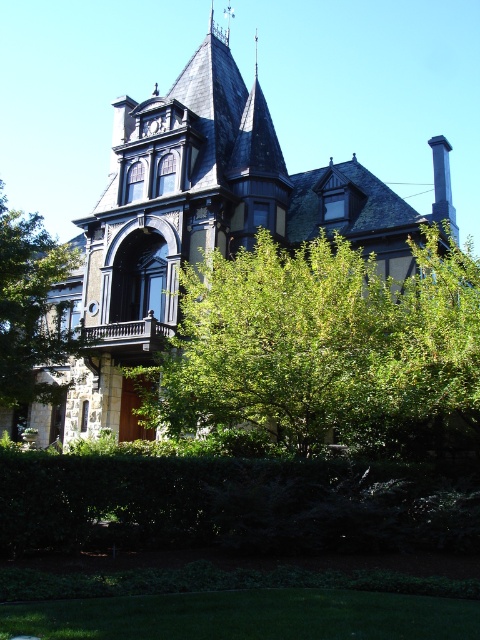
Consider the image. You are standing in front of the Victorian house and notice the dark gray stone mansion at center and the green leafy tree at center. Which object is positioned more to the left side of the scene?

The dark gray stone mansion at center is positioned more to the left side of the scene compared to the green leafy tree at center.

You are standing in a park and see the dark gray stone mansion at center in the distance. If you want to take a closer look, how many steps would you need to take to reach it if each step covers approximately 2.5 feet?

The dark gray stone mansion at center is 176.09 feet away from camera. To calculate the number of steps needed, divide the distance by the step length. 176.09 divided by 2.5 equals approximately 70.436 steps. Since you can only take whole steps, you would need to take about 71 steps to reach the mansion.

In the scene shown: You are standing in front of the dark gray stone mansion at center and want to take a photo of it. However, there is a green leafy tree at lower left blocking part of the mansion. Based on the scene description, which object is taller and might be obscuring the view?

The dark gray stone mansion at center is taller than the green leafy tree at lower left, so the mansion is taller and might be obscuring the view.